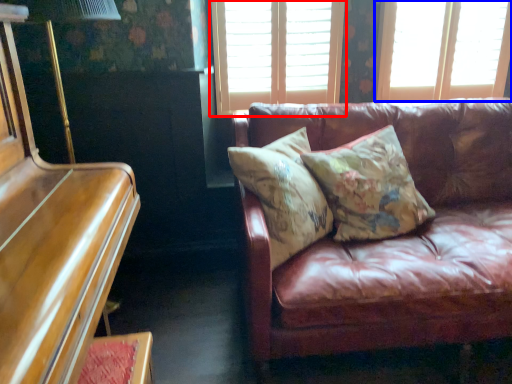
Question: Which object appears farthest to the camera in this image, window (highlighted by a red box) or window (highlighted by a blue box)?

Choices:
 (A) window
 (B) window

Answer: (B)